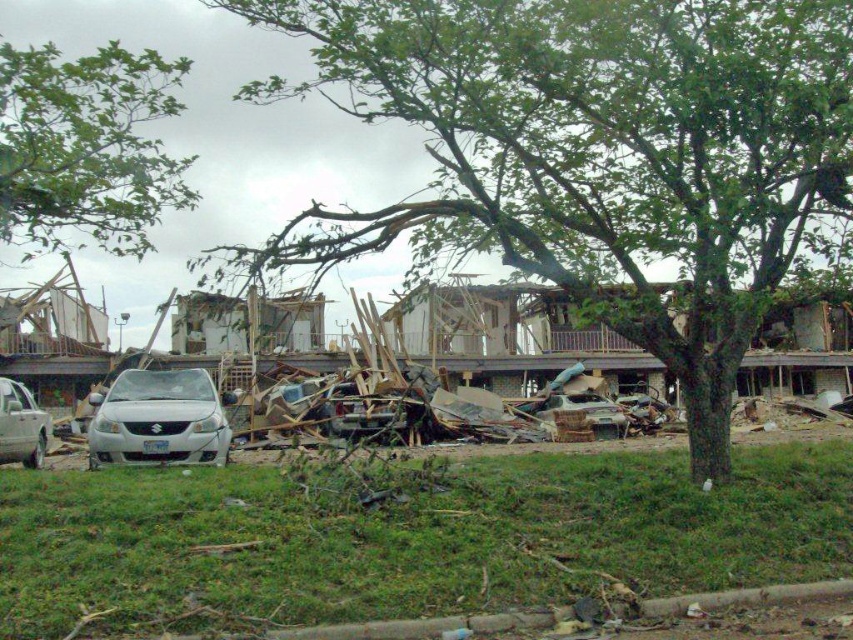
Who is higher up, green leafy tree at upper left or rusty metallic car at center?

green leafy tree at upper left is higher up.

Between point (131, 150) and point (593, 403), which one is positioned in front?

Point (131, 150) is more forward.

Is point (93, 208) positioned in front of point (596, 429)?

Yes, point (93, 208) is in front of point (596, 429).

At what (x,y) coordinates should I click in order to perform the action: click on green leafy tree at upper left. Please return your answer as a coordinate pair (x, y). The height and width of the screenshot is (640, 853). Looking at the image, I should click on (x=86, y=147).

Who is higher up, white matte car at center or rusty metallic car at center?

Positioned higher is white matte car at center.

Is white matte car at center below rusty metallic car at center?

Incorrect, white matte car at center is not positioned below rusty metallic car at center.

Is point (206, 436) positioned behind point (624, 429)?

No.

Find the location of `white matte car at center`. white matte car at center is located at coordinates (158, 419).

Is point (22, 109) positioned behind point (204, 424)?

No.

From the picture: Is green leafy tree at upper left bigger than white matte car at center?

Yes, green leafy tree at upper left is bigger than white matte car at center.

Between point (151, 220) and point (102, 396), which one is positioned in front?

Point (151, 220)

Locate an element on the screen. Image resolution: width=853 pixels, height=640 pixels. green leafy tree at upper left is located at coordinates (86, 147).